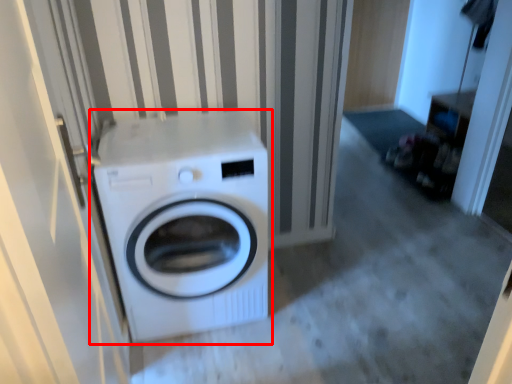
Question: From the image, what is the correct spatial relationship of washing machine (annotated by the red box) in relation to screen door?

Choices:
 (A) right
 (B) left

Answer: (A)